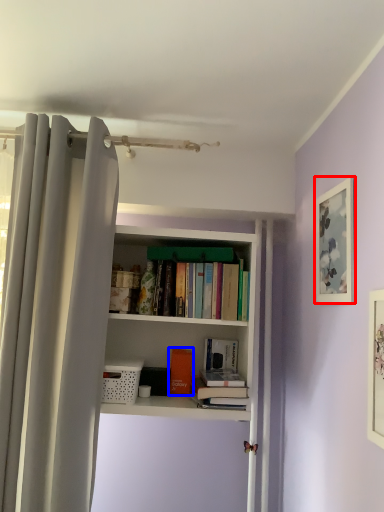
Question: Which of the following is the farthest to the observer, picture frame (highlighted by a red box) or book (highlighted by a blue box)?

Choices:
 (A) picture frame
 (B) book

Answer: (B)